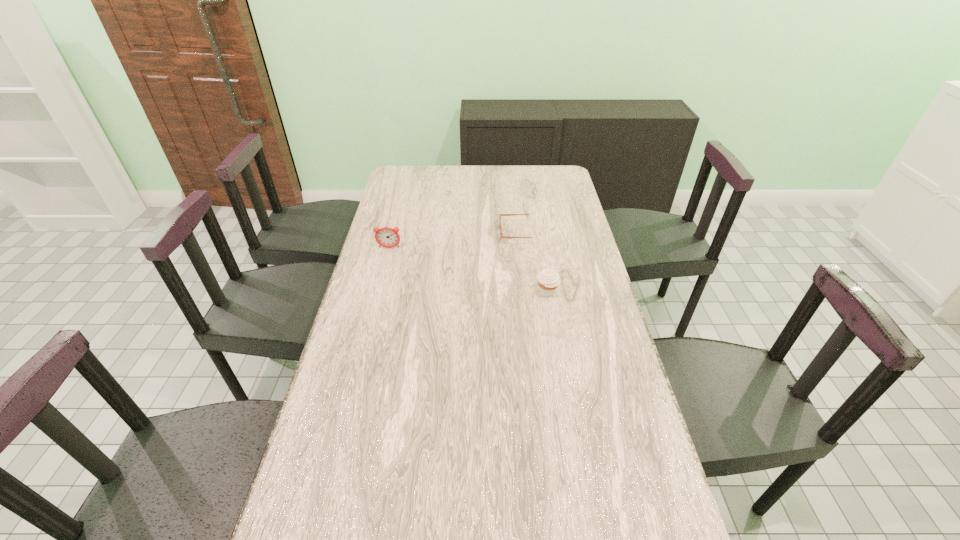
Find the location of a particular element. This screenshot has width=960, height=540. object positioned at the left edge is located at coordinates (387, 237).

I want to click on object positioned at the right edge, so click(548, 280).

I want to click on free region at the far edge of the desktop, so click(x=502, y=190).

This screenshot has height=540, width=960. In order to click on vacant position at the left edge of the desktop in this screenshot , I will do `click(340, 441)`.

In the image, there is a desktop. Identify the location of vacant space at the right edge. The width and height of the screenshot is (960, 540). (595, 344).

Identify the location of unoccupied position between the muffin and the sunglasses. tap(534, 263).

I want to click on object that stands as the second closest to the nearest object, so click(x=387, y=237).

In order to click on object that stands as the closest to the muffin in this screenshot , I will do `click(500, 215)`.

Where is `free spot that satisfies the following two spatial constraints: 1. on the front-facing side of the nearest object; 2. on the left side of the leftmost object`? This screenshot has width=960, height=540. free spot that satisfies the following two spatial constraints: 1. on the front-facing side of the nearest object; 2. on the left side of the leftmost object is located at coordinates (378, 292).

At what (x,y) coordinates should I click in order to perform the action: click on vacant space that satisfies the following two spatial constraints: 1. on the front-facing side of the sunglasses; 2. on the front-facing side of the second nearest object. Please return your answer as a coordinate pair (x, y). The image size is (960, 540). Looking at the image, I should click on (522, 248).